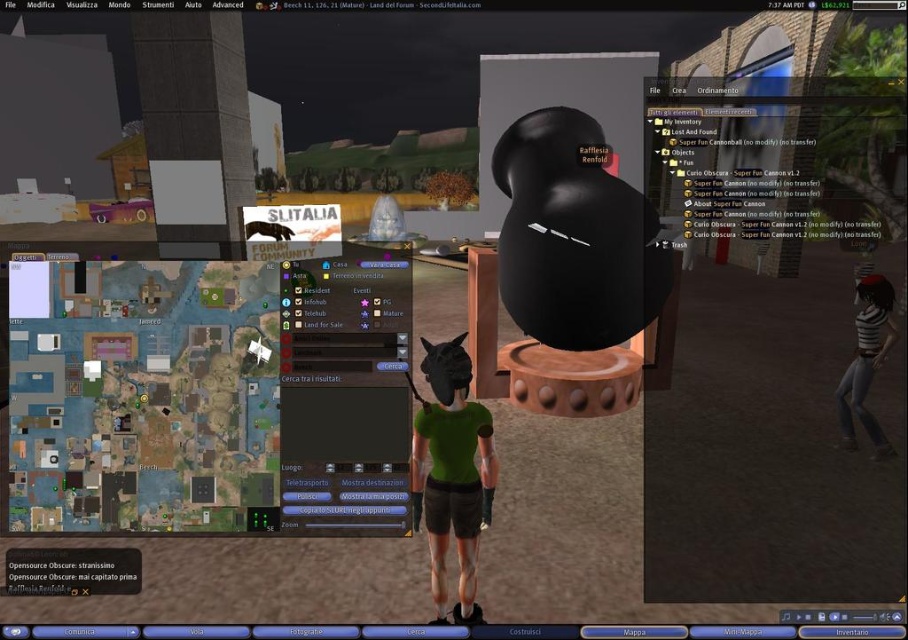
You are navigating a virtual world at night and need to move from your current position to a hidden treasure located at point B. You see two points marked in the scene. The first point is at coordinates point (x=456, y=518), and the second point is at coordinates point (x=873, y=364). Which point should you move towards first if you want to reach the treasure at point B efficiently?

Point (x=456, y=518) is in front of point (x=873, y=364), so you should move towards point (x=456, y=518) first to reach point B efficiently.

In the scene shown: You are a character in the game who needs to locate a hidden treasure. You have a matte green map at lower left and a striped fabric shirt at right. According to the map, the treasure is buried where the map overlaps the shirt. Where should you dig?

The matte green map at lower left is positioned over striped fabric shirt at right, so you should dig where the matte green map at lower left overlaps the striped fabric shirt at right.

In the scene shown: You are a character in this virtual environment and want to wear a larger shirt. Which shirt should you choose between the green matte shirt at center and the striped fabric shirt at right?

The striped fabric shirt at right is larger than the green matte shirt at center, so you should choose the striped fabric shirt at right.